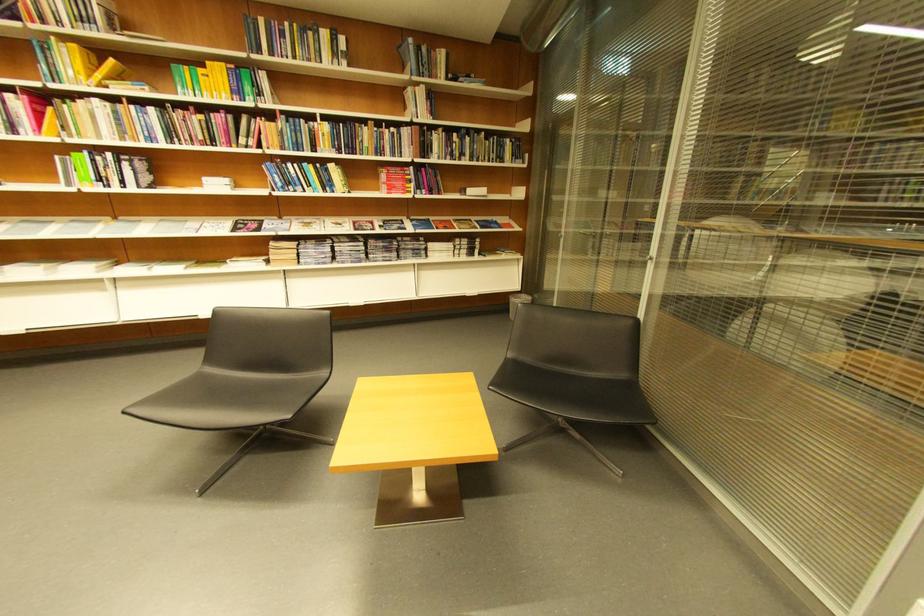
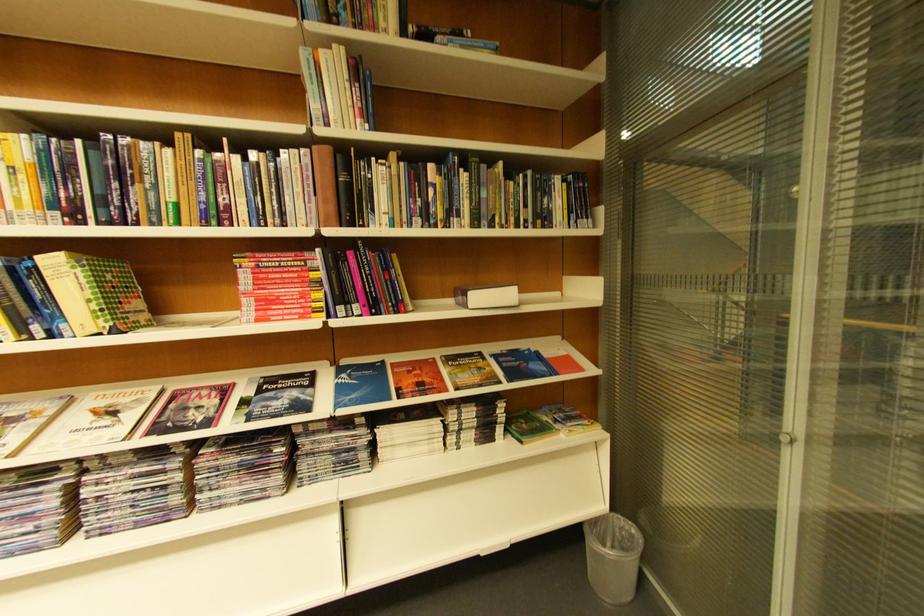
Where in the second image is the point corresponding to the point at 377,223 from the first image?

(224, 389)